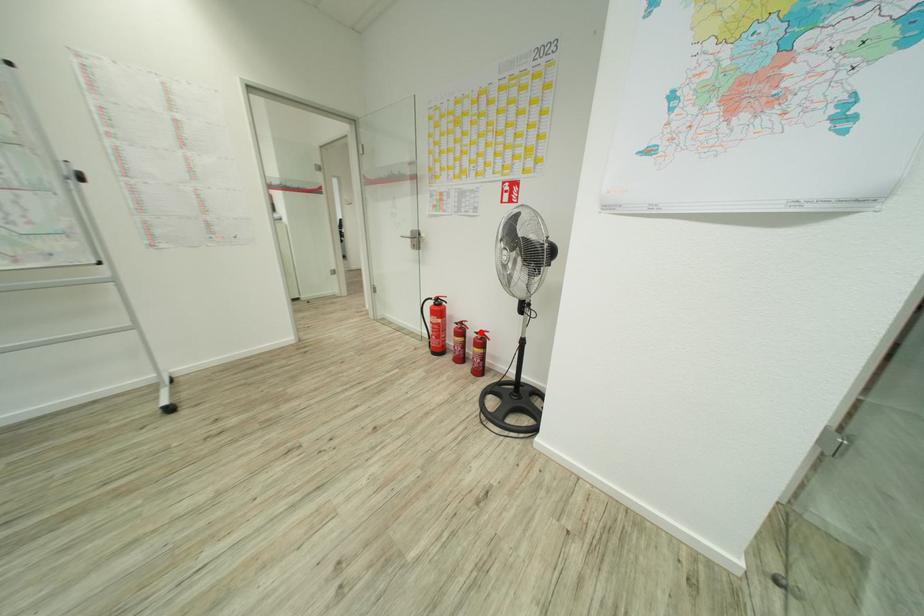
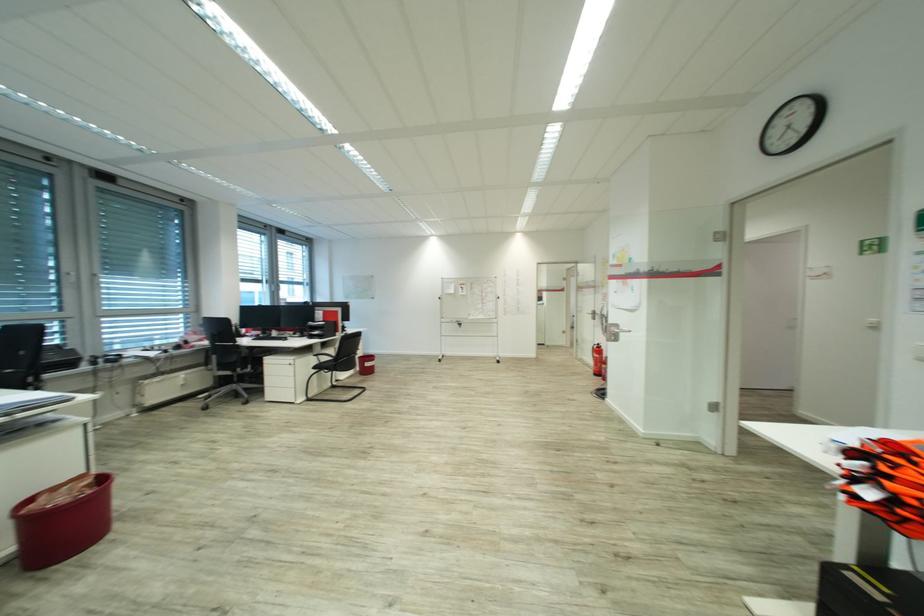
Question: I am providing you with two images of the same scene from different viewpoints. A red point is marked on the first image. At the location where the point appears in image 1, is it still visible in image 2?

Choices:
 (A) Yes
 (B) No

Answer: (B)